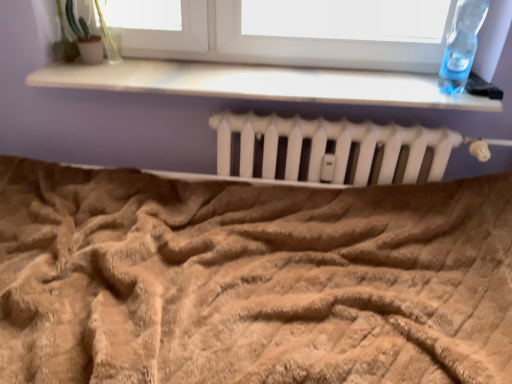
Question: Considering the relative positions of transparent plastic bottle at upper right and white matte radiator at center in the image provided, is transparent plastic bottle at upper right in front of white matte radiator at center?

Choices:
 (A) no
 (B) yes

Answer: (B)

Question: Can white matte radiator at center be found inside transparent plastic bottle at upper right?

Choices:
 (A) yes
 (B) no

Answer: (B)

Question: Considering the relative sizes of transparent plastic bottle at upper right and white matte radiator at center in the image provided, is transparent plastic bottle at upper right bigger than white matte radiator at center?

Choices:
 (A) yes
 (B) no

Answer: (B)

Question: From a real-world perspective, is transparent plastic bottle at upper right on top of white matte radiator at center?

Choices:
 (A) no
 (B) yes

Answer: (B)

Question: From the image's perspective, does transparent plastic bottle at upper right appear higher than white matte radiator at center?

Choices:
 (A) yes
 (B) no

Answer: (A)

Question: In terms of width, does green matte plant at upper left look wider or thinner when compared to white matte radiator at center?

Choices:
 (A) wide
 (B) thin

Answer: (B)

Question: Is green matte plant at upper left in front of or behind white matte radiator at center in the image?

Choices:
 (A) front
 (B) behind

Answer: (A)

Question: Do you think green matte plant at upper left is within white matte radiator at center, or outside of it?

Choices:
 (A) outside
 (B) inside

Answer: (A)

Question: Based on their sizes in the image, would you say green matte plant at upper left is bigger or smaller than white matte radiator at center?

Choices:
 (A) small
 (B) big

Answer: (A)

Question: Considering their positions, is beige textured blanket at center located in front of or behind transparent plastic bottle at upper right?

Choices:
 (A) front
 (B) behind

Answer: (A)

Question: Considering the positions of beige textured blanket at center and transparent plastic bottle at upper right in the image, is beige textured blanket at center bigger or smaller than transparent plastic bottle at upper right?

Choices:
 (A) big
 (B) small

Answer: (A)

Question: From the image's perspective, relative to transparent plastic bottle at upper right, is beige textured blanket at center above or below?

Choices:
 (A) below
 (B) above

Answer: (A)

Question: From a real-world perspective, is beige textured blanket at center above or below transparent plastic bottle at upper right?

Choices:
 (A) above
 (B) below

Answer: (B)

Question: Is transparent plastic bottle at upper right in front of or behind beige textured blanket at center in the image?

Choices:
 (A) front
 (B) behind

Answer: (B)

Question: Considering the positions of point (465, 23) and point (173, 327), is point (465, 23) closer or farther from the camera than point (173, 327)?

Choices:
 (A) closer
 (B) farther

Answer: (B)